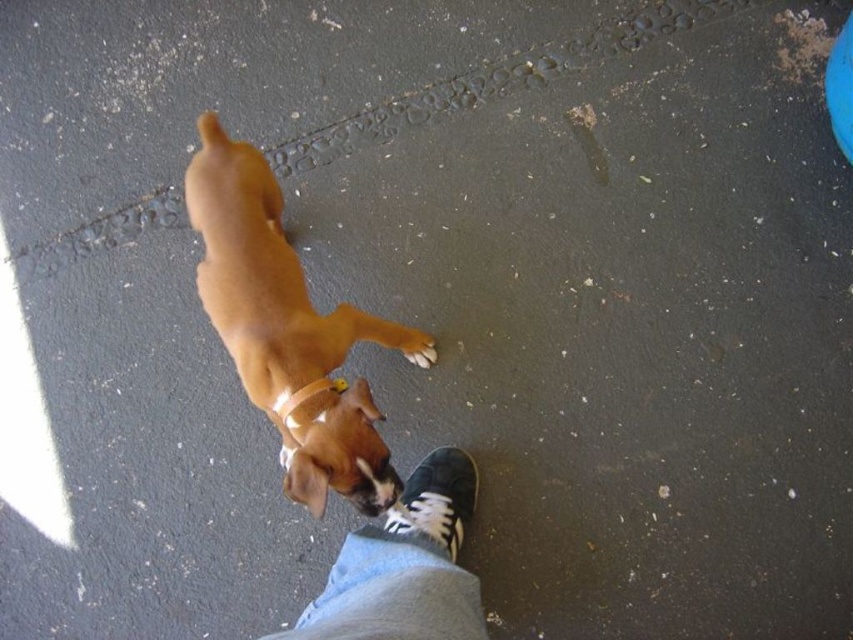
Question: Where is brown leather dog at center located in relation to denim pants at lower center in the image?

Choices:
 (A) right
 (B) left

Answer: (B)

Question: Which is farther from the denim pants at lower center?

Choices:
 (A) white leather shoe at center
 (B) brown leather dog at center
 (C) white rubber neckband at center

Answer: (B)

Question: Is white rubber neckband at center positioned at the back of brown fur paw at lower center?

Choices:
 (A) no
 (B) yes

Answer: (A)

Question: Which of the following is the farthest from the observer?

Choices:
 (A) (297, 433)
 (B) (328, 385)

Answer: (B)

Question: Considering the real-world distances, which object is closest to the brown leather dog at center?

Choices:
 (A) white rubber neckband at center
 (B) brown fur paw at lower center

Answer: (A)

Question: Does brown leather dog at center come in front of denim pants at lower center?

Choices:
 (A) yes
 (B) no

Answer: (B)